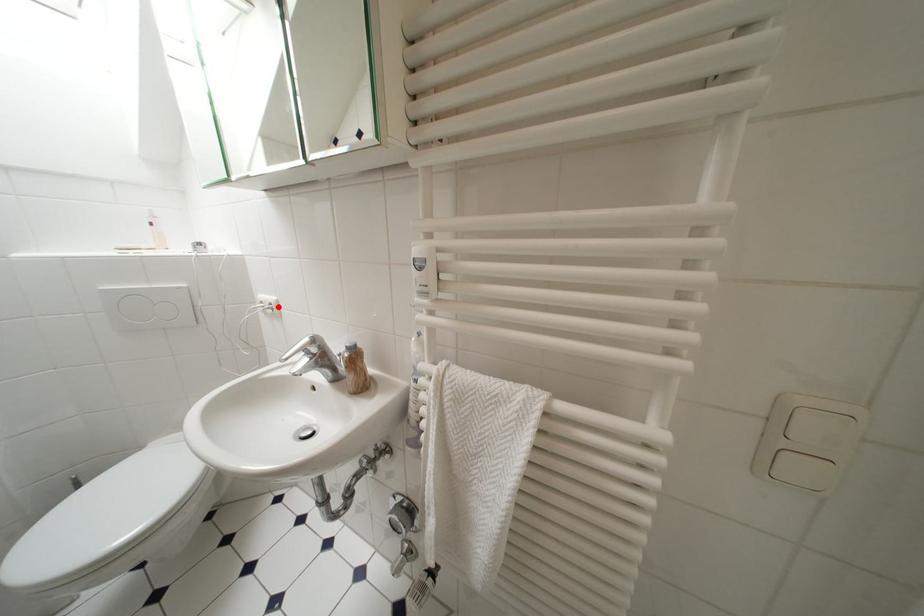
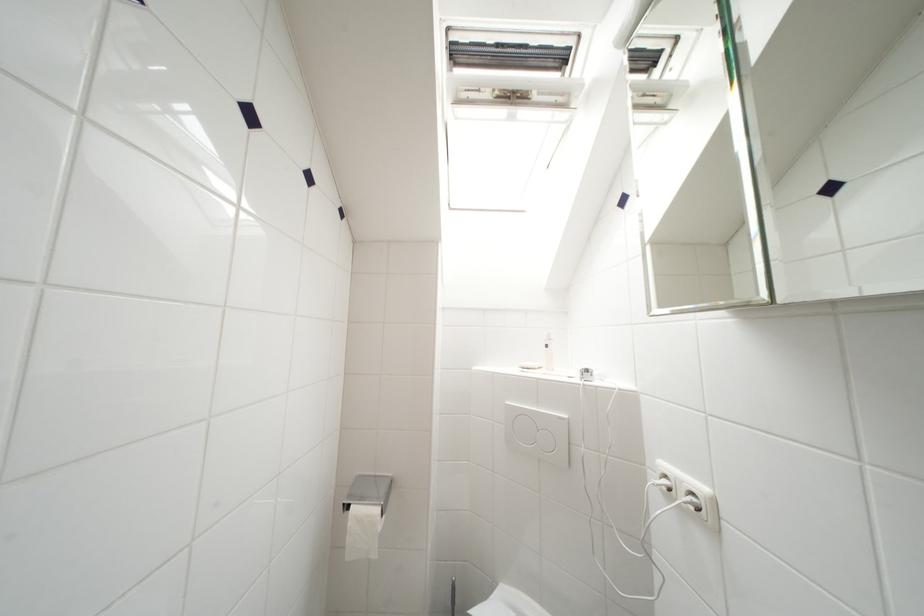
The point at the highlighted location is marked in the first image. Where is the corresponding point in the second image?

(699, 498)